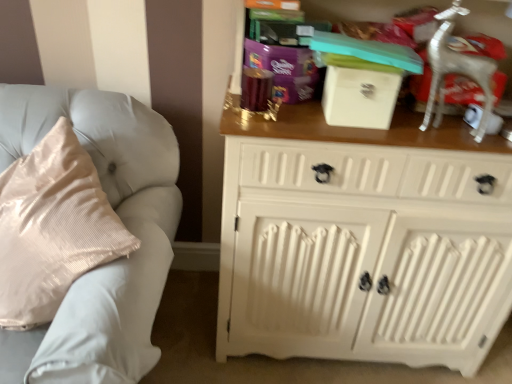
Question: Is point click(287, 49) closer or farther from the camera than point click(282, 180)?

Choices:
 (A) closer
 (B) farther

Answer: (B)

Question: In terms of size, does purple glossy gift at upper center appear bigger or smaller than white painted wood cabinet at right?

Choices:
 (A) small
 (B) big

Answer: (A)

Question: Which object is positioned closest to the purple glossy gift at upper center?

Choices:
 (A) light gray fabric couch at left
 (B) silver metallic deer at upper right
 (C) white matte box at upper center
 (D) white painted wood cabinet at right

Answer: (C)

Question: Considering the real-world distances, which object is closest to the silver metallic deer at upper right?

Choices:
 (A) white matte box at upper center
 (B) purple glossy gift at upper center
 (C) light gray fabric couch at left
 (D) white painted wood cabinet at right

Answer: (A)